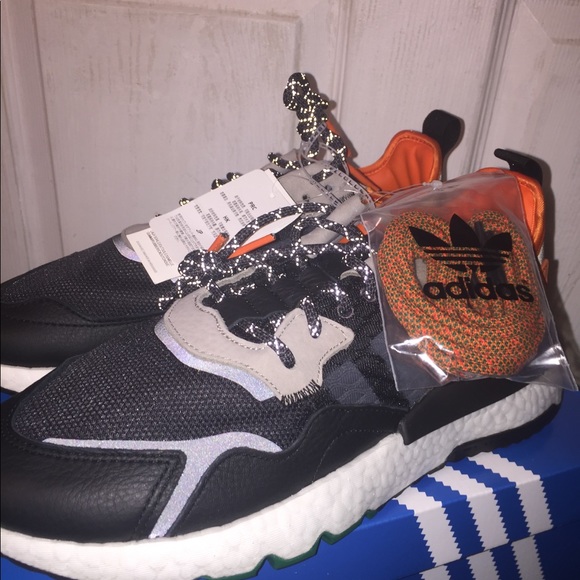
I want to click on wall, so click(x=403, y=77).